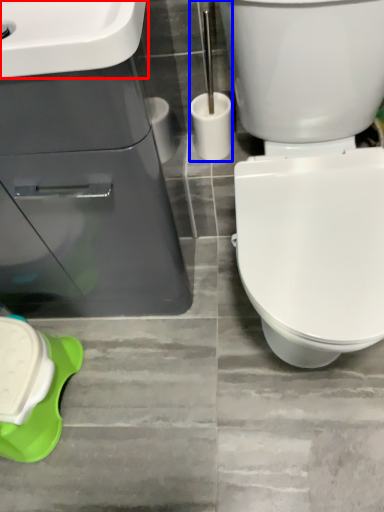
Question: Which object is further to the camera taking this photo, sink (highlighted by a red box) or brush (highlighted by a blue box)?

Choices:
 (A) sink
 (B) brush

Answer: (B)